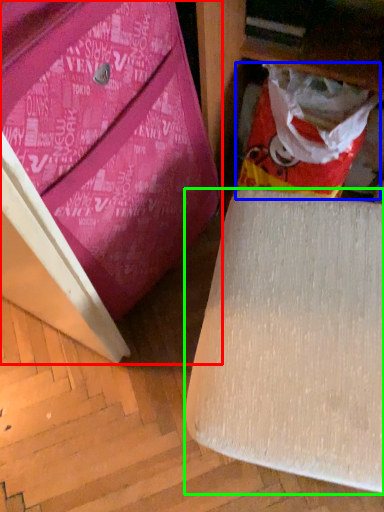
Question: Which is farther away from furniture (highlighted by a red box)? shopping bag (highlighted by a blue box) or furniture (highlighted by a green box)?

Choices:
 (A) shopping bag
 (B) furniture

Answer: (A)